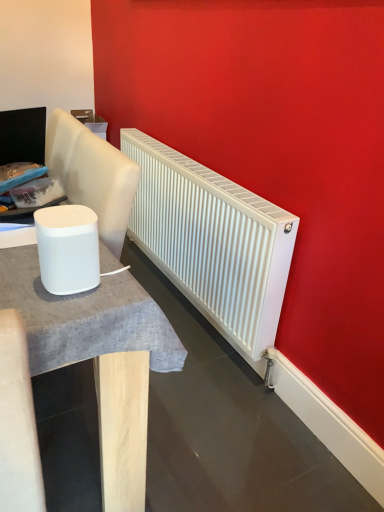
You are a GUI agent. You are given a task and a screenshot of the screen. Output one action in this format:
    pyautogui.click(x=<x>, y=<y>)
    Task: Click on the free space to the right of white matte speaker at left
    This screenshot has height=512, width=384.
    Given the screenshot: What is the action you would take?
    pyautogui.click(x=114, y=290)